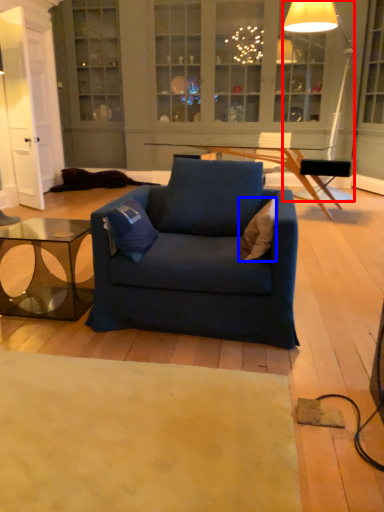
Question: Among these objects, which one is nearest to the camera, lamp (highlighted by a red box) or pillow (highlighted by a blue box)?

Choices:
 (A) lamp
 (B) pillow

Answer: (B)